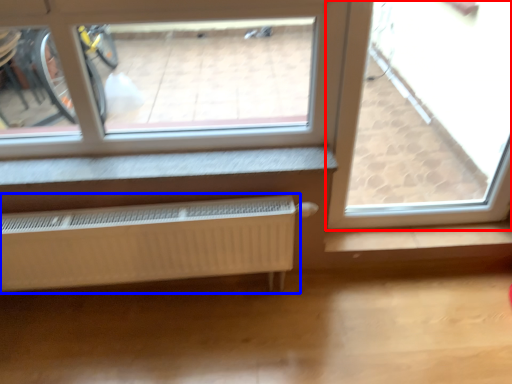
Question: Which point is closer to the camera, window (highlighted by a red box) or radiator (highlighted by a blue box)?

Choices:
 (A) window
 (B) radiator

Answer: (A)